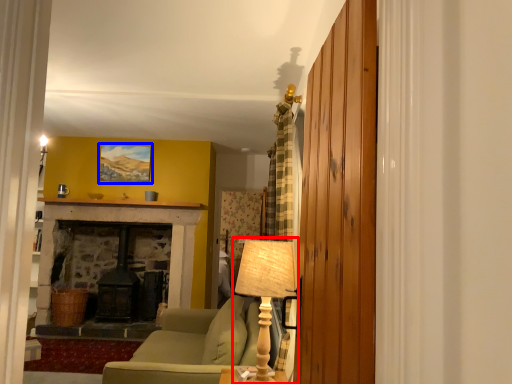
Question: Which point is further to the camera, table lamp (highlighted by a red box) or picture frame (highlighted by a blue box)?

Choices:
 (A) table lamp
 (B) picture frame

Answer: (B)